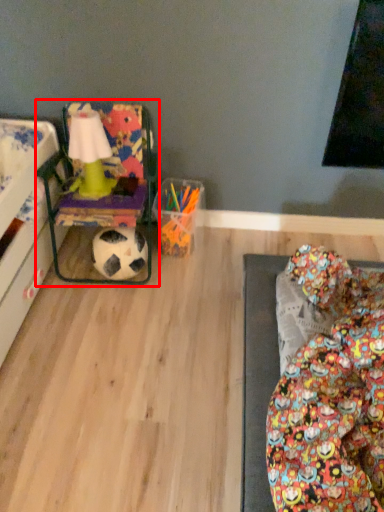
Question: From the image, what is the correct spatial relationship of bean bag chair (annotated by the red box) in relation to football?

Choices:
 (A) right
 (B) left

Answer: (B)